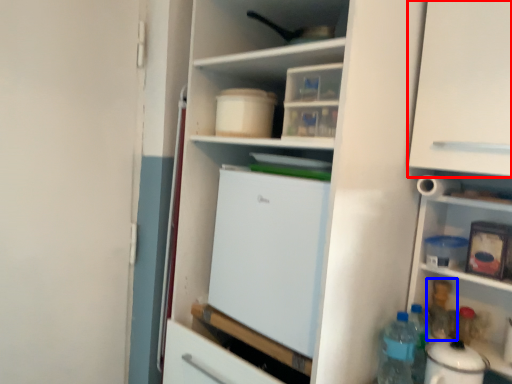
Question: Which object appears farthest to the camera in this image, cabinetry (highlighted by a red box) or bottle (highlighted by a blue box)?

Choices:
 (A) cabinetry
 (B) bottle

Answer: (B)